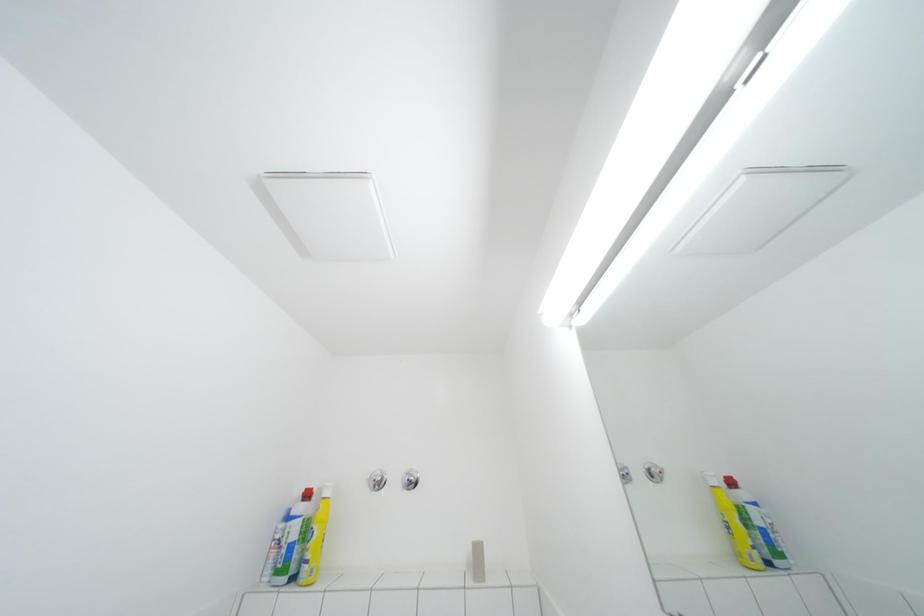
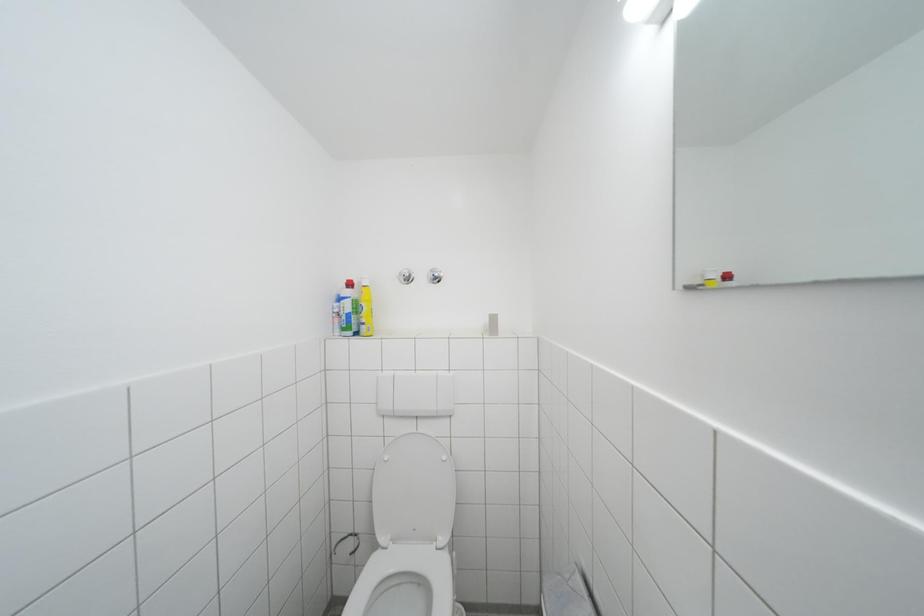
Question: The images are taken continuously from a first-person perspective. In which direction is your viewpoint rotating?

Choices:
 (A) Left
 (B) Right
 (C) Up
 (D) Down

Answer: (D)